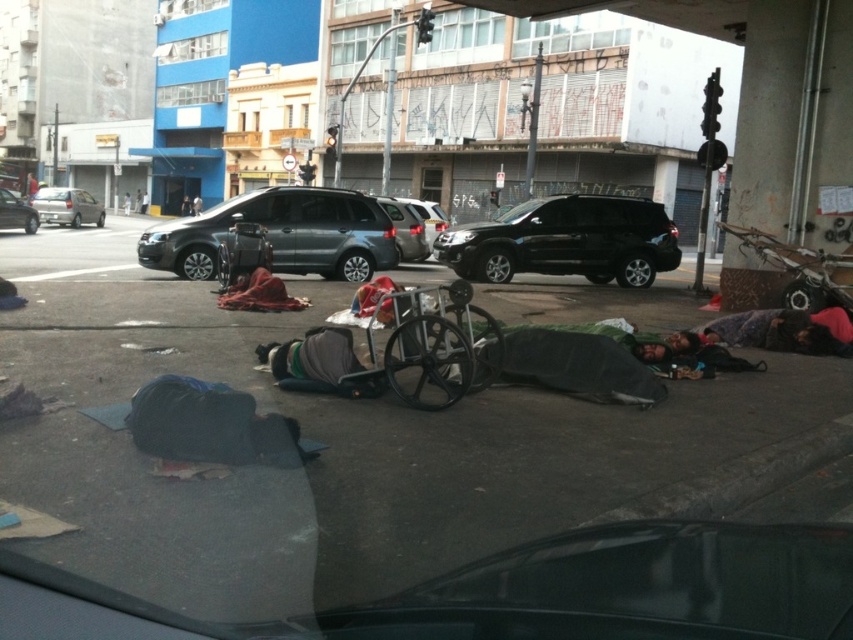
Question: Does black matte suv at center have a greater width compared to matte gray suv at center?

Choices:
 (A) no
 (B) yes

Answer: (A)

Question: Considering the real-world distances, which object is farthest from the dark gray fabric sleeping bag at lower right?

Choices:
 (A) metallic silver car at center
 (B) black matte suv at center
 (C) metallic gray suv at center

Answer: (A)

Question: Which point is closer to the camera?

Choices:
 (A) silver metallic sedan at center-left
 (B) silver metallic van at left
 (C) metallic gray suv at center
 (D) black matte suv at center

Answer: (D)

Question: Is metallic gray suv at center bigger than silver metallic sedan at center-left?

Choices:
 (A) no
 (B) yes

Answer: (A)

Question: Which of the following is the farthest from the observer?

Choices:
 (A) (78, 188)
 (B) (474, 248)
 (C) (410, 227)

Answer: (A)

Question: Is silver metallic van at left to the right of metallic gray suv at center from the viewer's perspective?

Choices:
 (A) yes
 (B) no

Answer: (B)